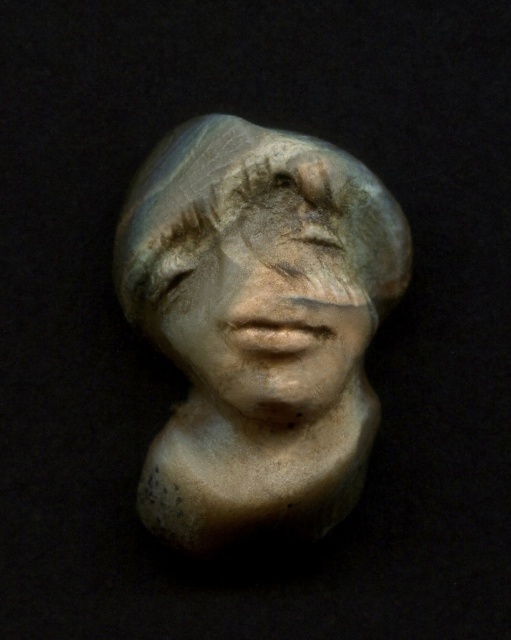
Is matte stone bust at center wider than matte stone face at center?

Yes, matte stone bust at center is wider than matte stone face at center.

Which is behind, point (151, 182) or point (197, 212)?

The point (151, 182) is more distant.

You are a GUI agent. You are given a task and a screenshot of the screen. Output one action in this format:
    pyautogui.click(x=<x>, y=<y>)
    Task: Click on the matte stone bust at center
    The height and width of the screenshot is (640, 511).
    Given the screenshot: What is the action you would take?
    pyautogui.click(x=258, y=324)